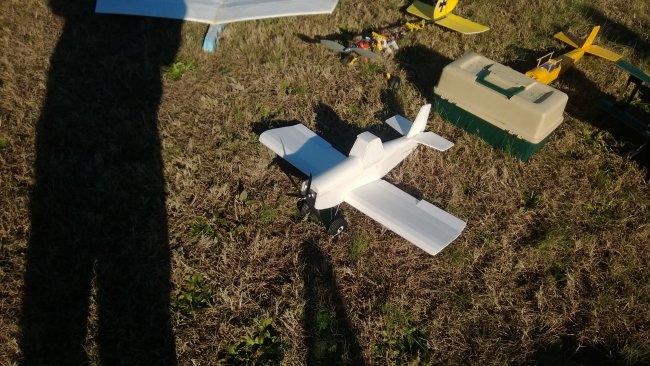
I want to click on handle, so click(491, 78).